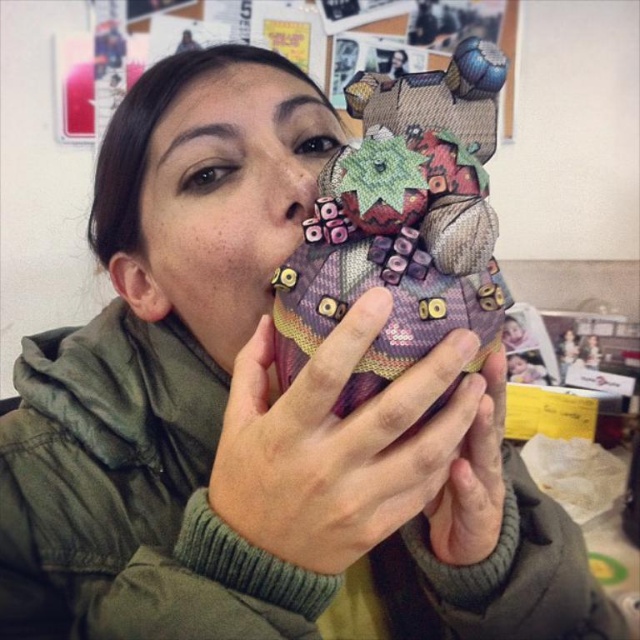
Does purple fabric hand at center have a smaller size compared to matte purple fabric face at center?

Correct, purple fabric hand at center occupies less space than matte purple fabric face at center.

Does purple fabric hand at center have a lesser height compared to matte purple fabric face at center?

Indeed, purple fabric hand at center has a lesser height compared to matte purple fabric face at center.

Measure the distance between purple fabric hand at center and camera.

purple fabric hand at center and camera are 29.74 centimeters apart from each other.

This screenshot has width=640, height=640. In order to click on purple fabric hand at center in this screenshot , I will do `click(355, 451)`.

Does plaid fabric bear at center have a larger size compared to purple fabric hand at center?

Incorrect, plaid fabric bear at center is not larger than purple fabric hand at center.

Is plaid fabric bear at center closer to the viewer compared to purple fabric hand at center?

No, plaid fabric bear at center is further to the viewer.

Which is behind, point (432, 305) or point (364, 552)?

The point (364, 552) is behind.

The height and width of the screenshot is (640, 640). I want to click on plaid fabric bear at center, so click(x=403, y=224).

Which is in front, point (282, 273) or point (481, 518)?

Point (282, 273) is in front.

Can you confirm if plaid fabric bear at center is positioned to the right of matte purple fabric at center?

No, plaid fabric bear at center is not to the right of matte purple fabric at center.

What do you see at coordinates (403, 224) in the screenshot? I see `plaid fabric bear at center` at bounding box center [403, 224].

Find the location of a particular element. plaid fabric bear at center is located at coordinates (403, 224).